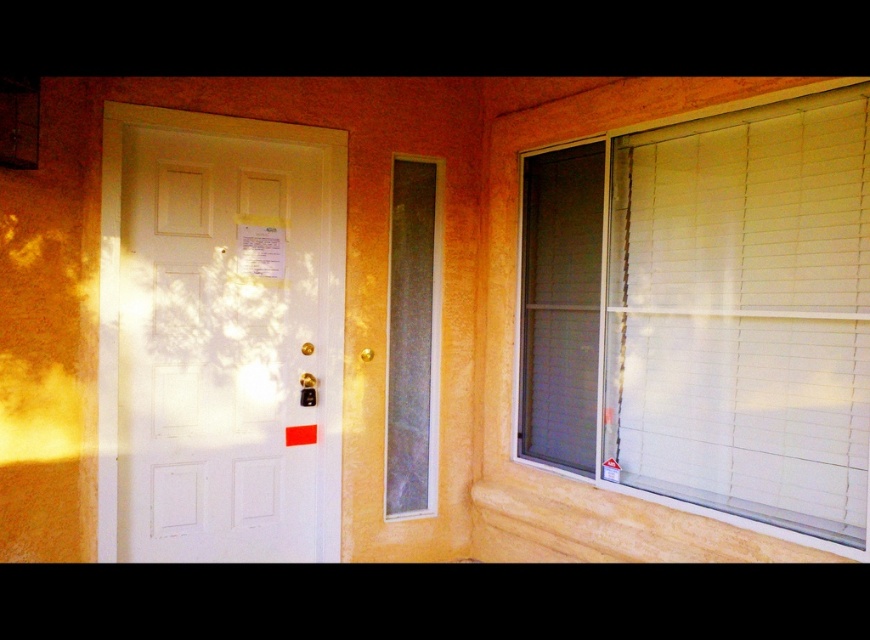
You are a window installer checking the layout of the building. You need to replace the clear glass window at center with a new one. Which direction should you move to reach it from the white matte blinds at right?

Since the white matte blinds at right are to the right of the clear glass window at center, you should move to the left to reach the clear glass window at center from the white matte blinds at right.